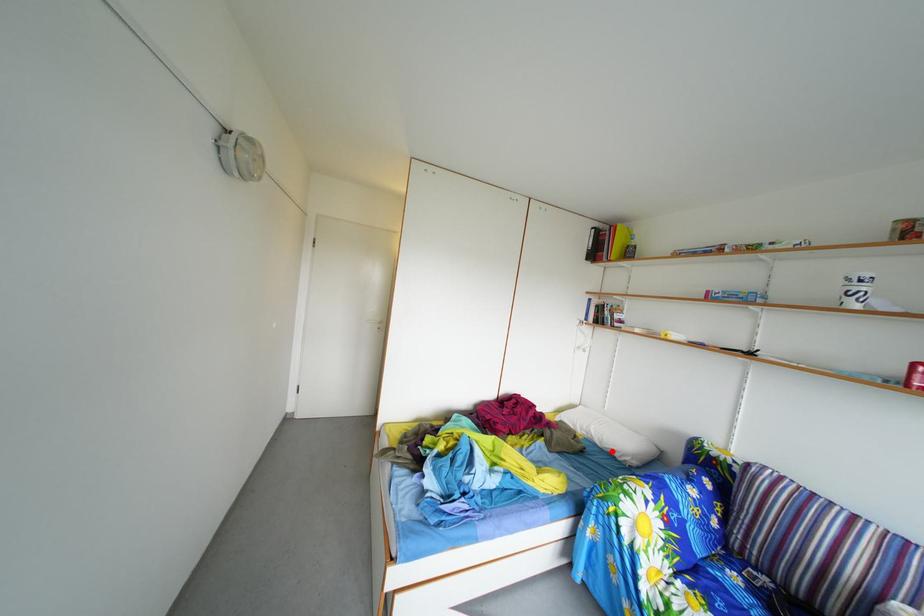
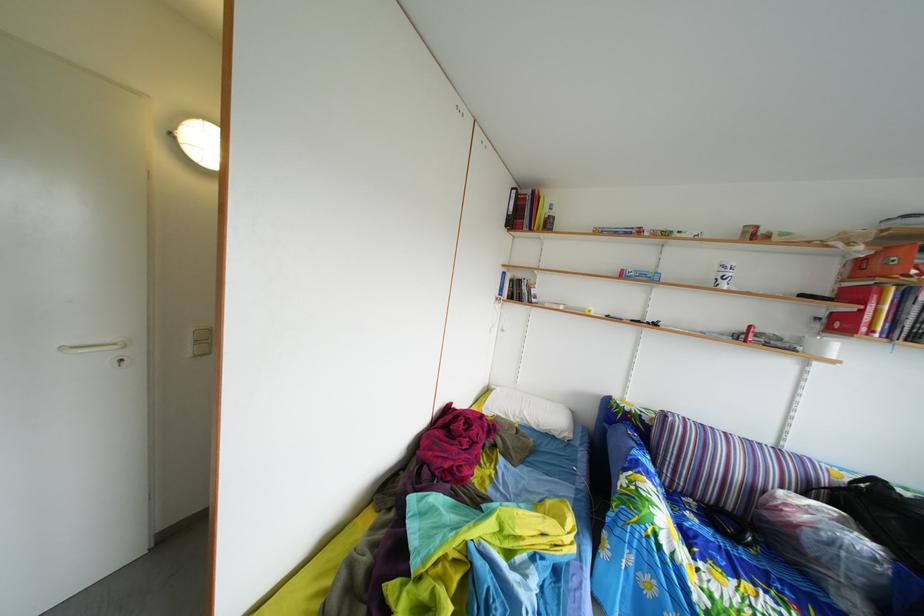
Locate, in the second image, the point that corresponds to the highlighted location in the first image.

(549, 434)